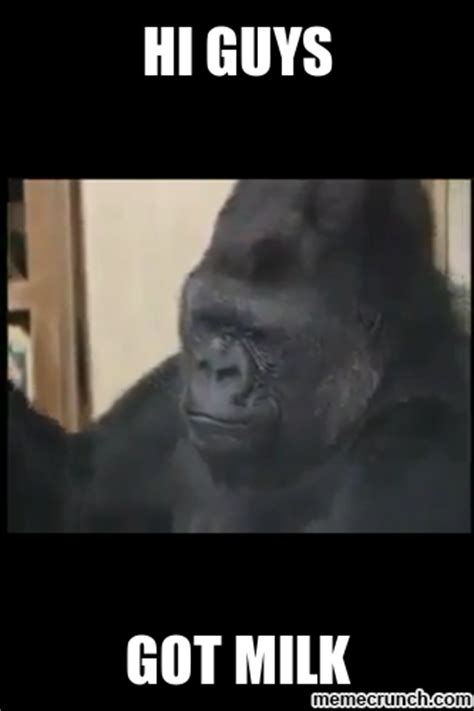
Find the location of a particular element. tan wall is located at coordinates (126, 208).